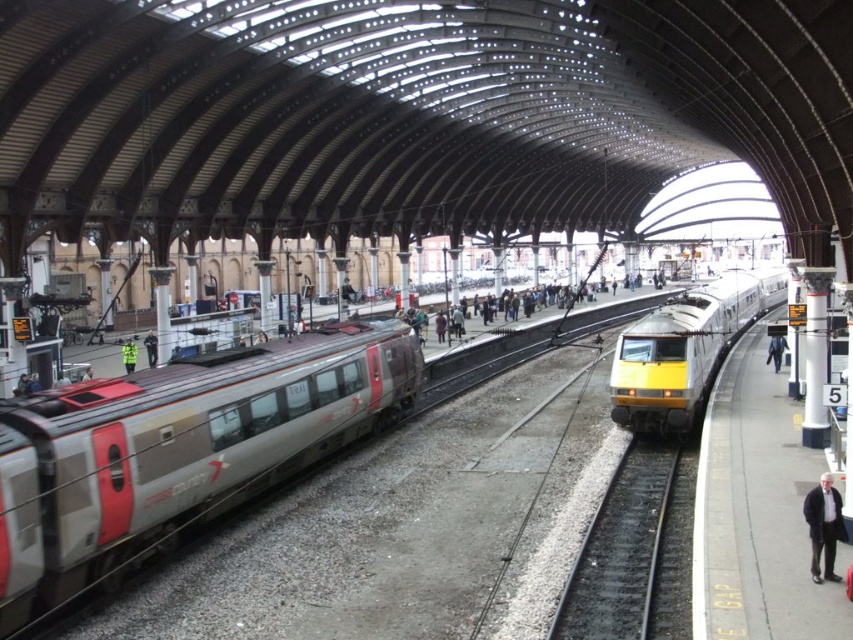
Which of these two, silver/grey metallic train at left or high visibility jacket at center, stands taller?

silver/grey metallic train at left is taller.

Is point (354, 429) positioned after point (151, 340)?

No, (354, 429) is in front of (151, 340).

Which is in front, point (61, 458) or point (148, 364)?

Point (61, 458) is in front.

Identify the location of silver/grey metallic train at left. (177, 451).

Can you confirm if silver/grey metallic train at left is bigger than yellow metallic train at center?

Actually, silver/grey metallic train at left might be smaller than yellow metallic train at center.

Is silver/grey metallic train at left to the right of yellow metallic train at center from the viewer's perspective?

No, silver/grey metallic train at left is not to the right of yellow metallic train at center.

Is point (140, 419) farther from camera compared to point (759, 305)?

No, (140, 419) is closer to viewer.

Where is `silver/grey metallic train at left`? The width and height of the screenshot is (853, 640). silver/grey metallic train at left is located at coordinates (177, 451).

Consider the image. Does yellow metallic train at center come behind high visibility jacket at center?

No, yellow metallic train at center is in front of high visibility jacket at center.

Based on the photo, between yellow metallic train at center and high visibility jacket at center, which one has more height?

With more height is yellow metallic train at center.

Between point (616, 348) and point (148, 336), which one is positioned in front?

Point (616, 348) is in front.

Identify the location of yellow metallic train at center. The height and width of the screenshot is (640, 853). (683, 349).